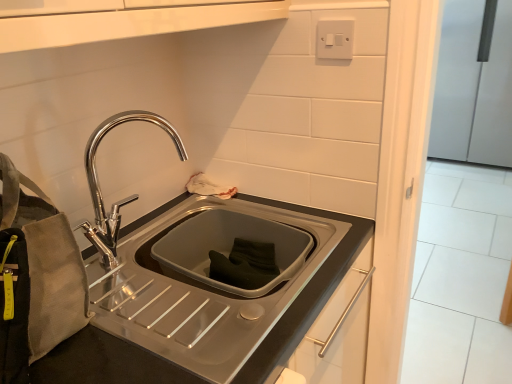
Question: Can you confirm if satin silver refrigerator at right is positioned to the left of canvas pouch at left?

Choices:
 (A) no
 (B) yes

Answer: (A)

Question: Can you confirm if satin silver refrigerator at right is smaller than canvas pouch at left?

Choices:
 (A) yes
 (B) no

Answer: (B)

Question: Can we say satin silver refrigerator at right lies outside canvas pouch at left?

Choices:
 (A) no
 (B) yes

Answer: (B)

Question: Does satin silver refrigerator at right lie behind canvas pouch at left?

Choices:
 (A) no
 (B) yes

Answer: (B)

Question: Is satin silver refrigerator at right to the right of canvas pouch at left from the viewer's perspective?

Choices:
 (A) yes
 (B) no

Answer: (A)

Question: In terms of height, does satin silver refrigerator at right look taller or shorter compared to canvas pouch at left?

Choices:
 (A) tall
 (B) short

Answer: (A)

Question: Is satin silver refrigerator at right bigger or smaller than canvas pouch at left?

Choices:
 (A) small
 (B) big

Answer: (B)

Question: Would you say satin silver refrigerator at right is inside or outside canvas pouch at left?

Choices:
 (A) outside
 (B) inside

Answer: (A)

Question: Is satin silver refrigerator at right to the left or to the right of canvas pouch at left in the image?

Choices:
 (A) right
 (B) left

Answer: (A)

Question: Is canvas pouch at left in front of or behind polished metal faucet at upper left in the image?

Choices:
 (A) behind
 (B) front

Answer: (B)

Question: Considering the positions of canvas pouch at left and polished metal faucet at upper left in the image, is canvas pouch at left wider or thinner than polished metal faucet at upper left?

Choices:
 (A) wide
 (B) thin

Answer: (A)

Question: From a real-world perspective, is canvas pouch at left positioned above or below polished metal faucet at upper left?

Choices:
 (A) below
 (B) above

Answer: (B)

Question: Is canvas pouch at left to the left or to the right of polished metal faucet at upper left in the image?

Choices:
 (A) right
 (B) left

Answer: (B)

Question: In terms of height, does white plastic switch at upper right look taller or shorter compared to canvas pouch at left?

Choices:
 (A) short
 (B) tall

Answer: (A)

Question: Is white plastic switch at upper right inside or outside of canvas pouch at left?

Choices:
 (A) outside
 (B) inside

Answer: (A)